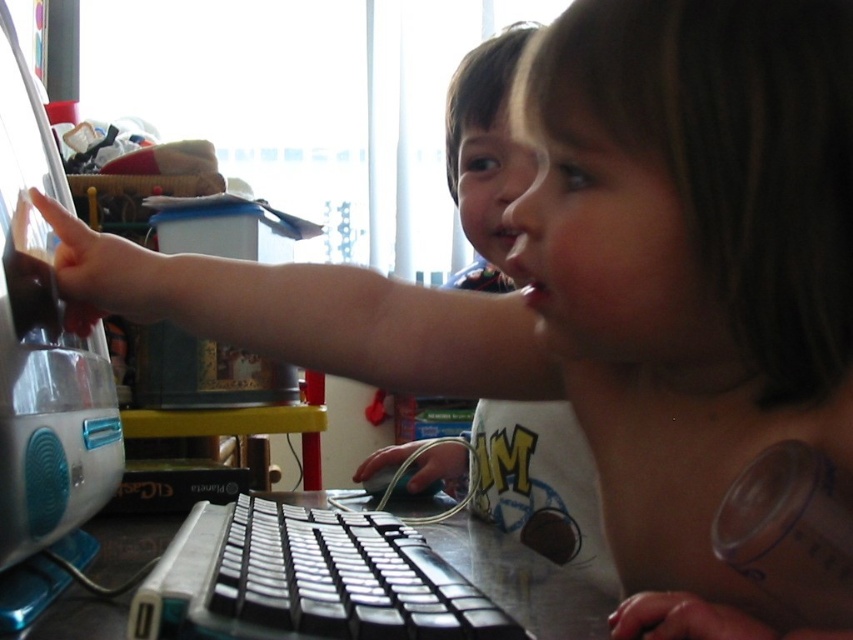
You are setting up a desk for a child. You have a teal plastic desktop computer at left and a matte black keyboard at center. Which object is shorter and needs to be placed on a higher surface to align their tops?

The teal plastic desktop computer at left is shorter than the matte black keyboard at center, so it needs to be placed on a higher surface to align their tops.

From the picture: You are a photographer trying to capture a closeup of the pink matte lips at center without including the black plastic keyboard at center in the frame. Given their spatial relationship, is this possible?

The black plastic keyboard at center is wider than the pink matte lips at center. Since the keyboard is at the center and wider, it would likely block the lips from being framed without the keyboard in the shot.

You are setting up a desk for two children to work on a computer together. The desk has limited space. Based on the image, which object between the teal plastic desktop computer at left and the matte black keyboard at center would you prioritize placing first to ensure both can comfortably use the computer?

The teal plastic desktop computer at left occupies less space than the matte black keyboard at center, so you should prioritize placing the teal plastic desktop computer at left first to accommodate the larger keyboard later.